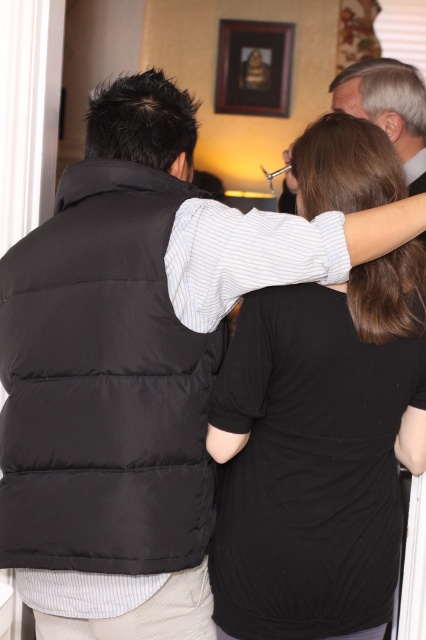
Question: Does black puffer vest at center appear on the right side of wooden picture frame at upper center?

Choices:
 (A) yes
 (B) no

Answer: (B)

Question: Which is farther from the black matte shirt at upper center?

Choices:
 (A) black puffer vest at center
 (B) wooden picture frame at upper center

Answer: (B)

Question: Is black matte shirt at upper center to the left of black puffer vest at center from the viewer's perspective?

Choices:
 (A) no
 (B) yes

Answer: (A)

Question: Which of the following is the closest to the observer?

Choices:
 (A) (6, 442)
 (B) (273, 113)

Answer: (A)

Question: Does black matte shirt at upper center appear over wooden picture frame at upper center?

Choices:
 (A) no
 (B) yes

Answer: (A)

Question: Which object is closer to the camera taking this photo?

Choices:
 (A) wooden picture frame at upper center
 (B) black matte shirt at upper center
 (C) black puffer vest at center

Answer: (C)